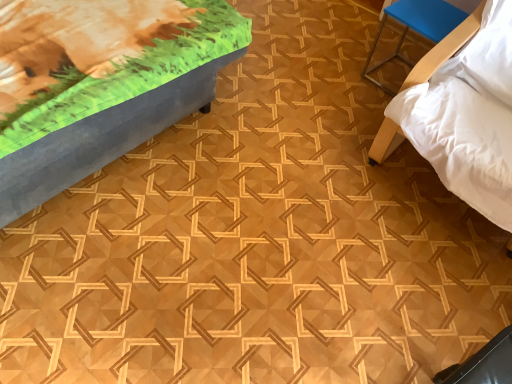
Question: Is matte gray bench at upper left, acting as the 1th furniture starting from the left, aimed at white soft bed at right, the first furniture from the right?

Choices:
 (A) yes
 (B) no

Answer: (A)

Question: Can you confirm if matte gray bench at upper left, marked as the 3th furniture in a right-to-left arrangement, is thinner than white soft bed at right, the 3th furniture from the left?

Choices:
 (A) no
 (B) yes

Answer: (B)

Question: Is matte gray bench at upper left, acting as the 1th furniture starting from the left, not inside white soft bed at right, the 3th furniture from the left?

Choices:
 (A) yes
 (B) no

Answer: (A)

Question: Considering the relative positions of matte gray bench at upper left, acting as the 1th furniture starting from the left, and white soft bed at right, the first furniture from the right, in the image provided, is matte gray bench at upper left, acting as the 1th furniture starting from the left, in front of white soft bed at right, the first furniture from the right,?

Choices:
 (A) no
 (B) yes

Answer: (B)

Question: Does matte gray bench at upper left, marked as the 3th furniture in a right-to-left arrangement, have a greater width compared to white soft bed at right, the first furniture from the right?

Choices:
 (A) yes
 (B) no

Answer: (B)

Question: From a real-world perspective, is matte gray bench at upper left, acting as the 1th furniture starting from the left, under white soft bed at right, the 3th furniture from the left?

Choices:
 (A) yes
 (B) no

Answer: (A)

Question: From the image's perspective, is blue plastic stool at upper right, positioned as the 2th furniture in right-to-left order, under white soft bed at right, the first furniture from the right?

Choices:
 (A) no
 (B) yes

Answer: (A)

Question: Considering the relative positions of blue plastic stool at upper right, marked as the second furniture in a left-to-right arrangement, and white soft bed at right, the 3th furniture from the left, in the image provided, is blue plastic stool at upper right, marked as the second furniture in a left-to-right arrangement, to the left of white soft bed at right, the 3th furniture from the left, from the viewer's perspective?

Choices:
 (A) yes
 (B) no

Answer: (A)

Question: From a real-world perspective, is blue plastic stool at upper right, positioned as the 2th furniture in right-to-left order, below white soft bed at right, the first furniture from the right?

Choices:
 (A) no
 (B) yes

Answer: (B)

Question: Does blue plastic stool at upper right, positioned as the 2th furniture in right-to-left order, have a smaller size compared to white soft bed at right, the 3th furniture from the left?

Choices:
 (A) yes
 (B) no

Answer: (A)

Question: Does blue plastic stool at upper right, marked as the second furniture in a left-to-right arrangement, have a lesser width compared to white soft bed at right, the 3th furniture from the left?

Choices:
 (A) yes
 (B) no

Answer: (A)

Question: Would you say blue plastic stool at upper right, marked as the second furniture in a left-to-right arrangement, contains white soft bed at right, the 3th furniture from the left?

Choices:
 (A) yes
 (B) no

Answer: (B)

Question: Does white soft bed at right, the first furniture from the right, come behind matte gray bench at upper left, acting as the 1th furniture starting from the left?

Choices:
 (A) no
 (B) yes

Answer: (B)